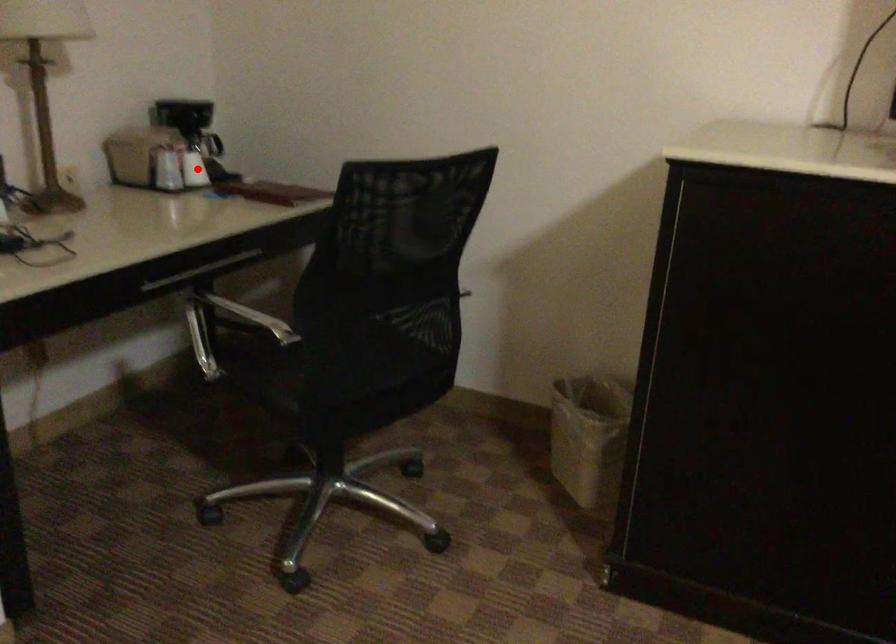
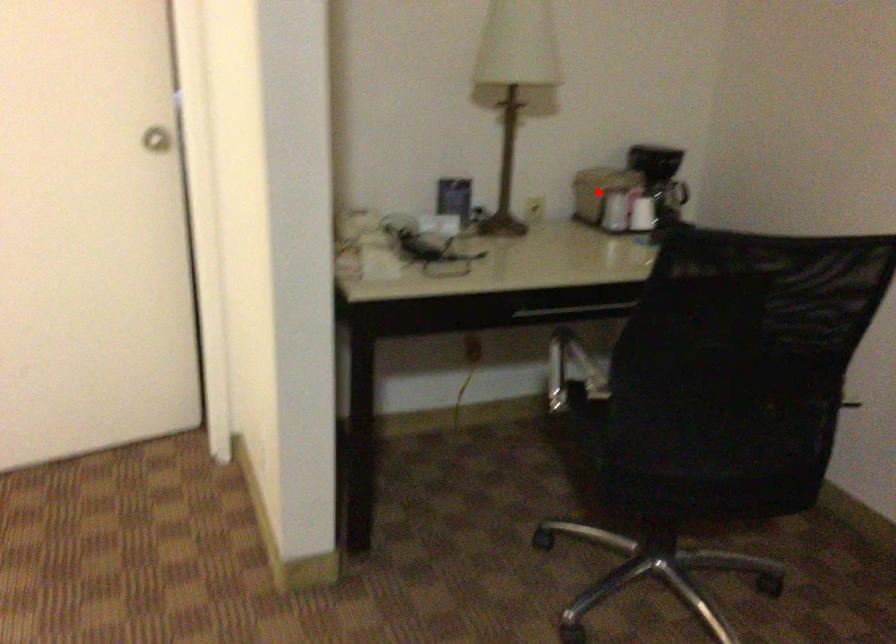
I am providing you with two images of the same scene from different viewpoints. A red point is marked on the first image and another point is marked on the second image. Are the points marked in image1 and image2 representing the same 3D position?

No